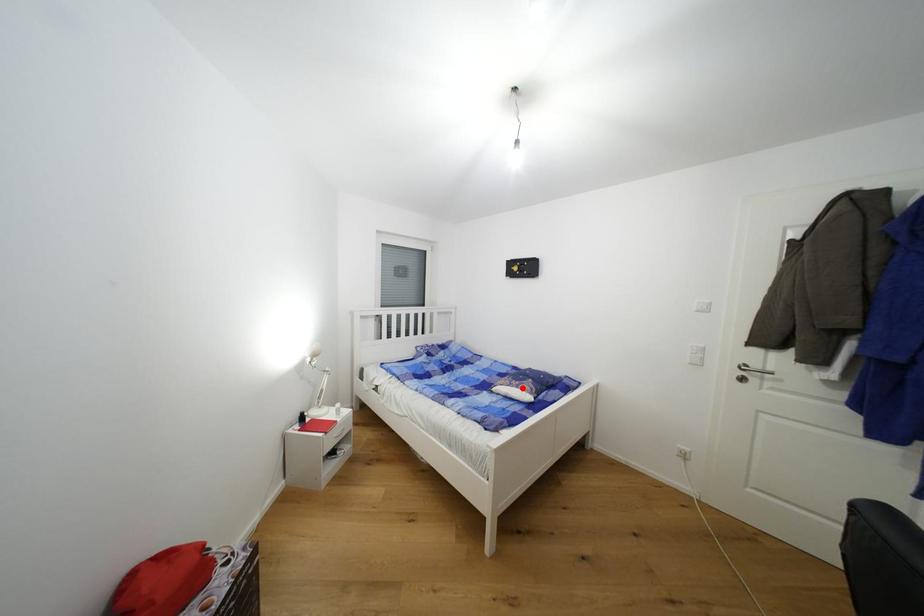
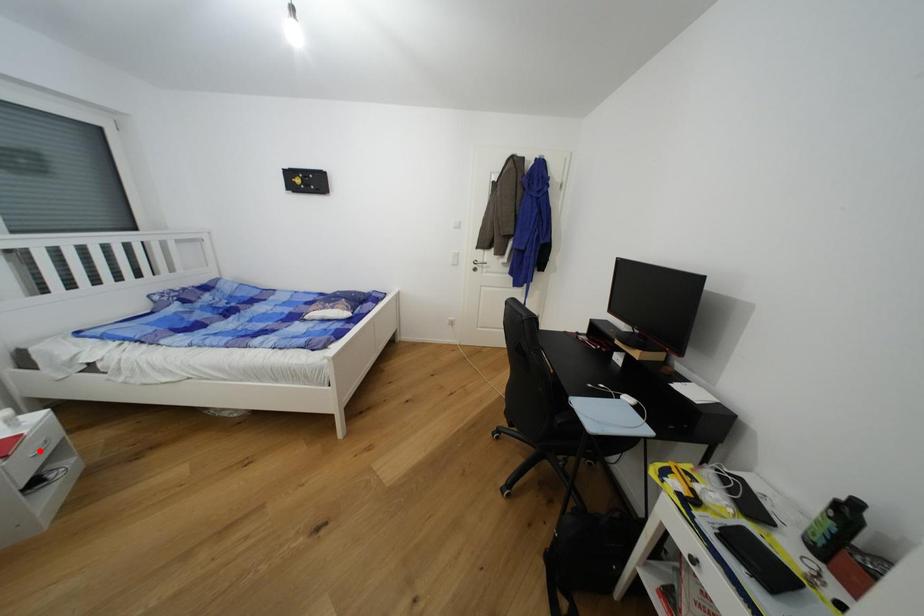
I am providing you with two images of the same scene from different viewpoints. A red point is marked on the first image and another point is marked on the second image. Is the marked point in image1 the same physical position as the marked point in image2?

No